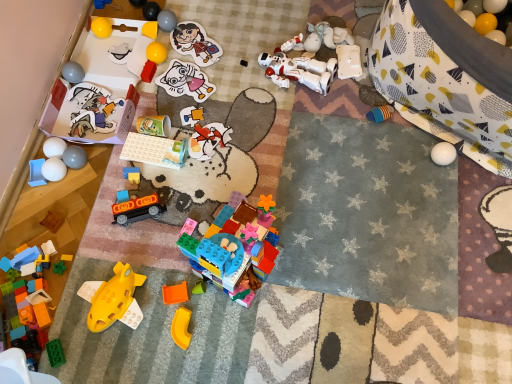
The width and height of the screenshot is (512, 384). Identify the location of vacant space to the right of white matte robot at upper center, the 3th toy viewed from the right. (x=358, y=82).